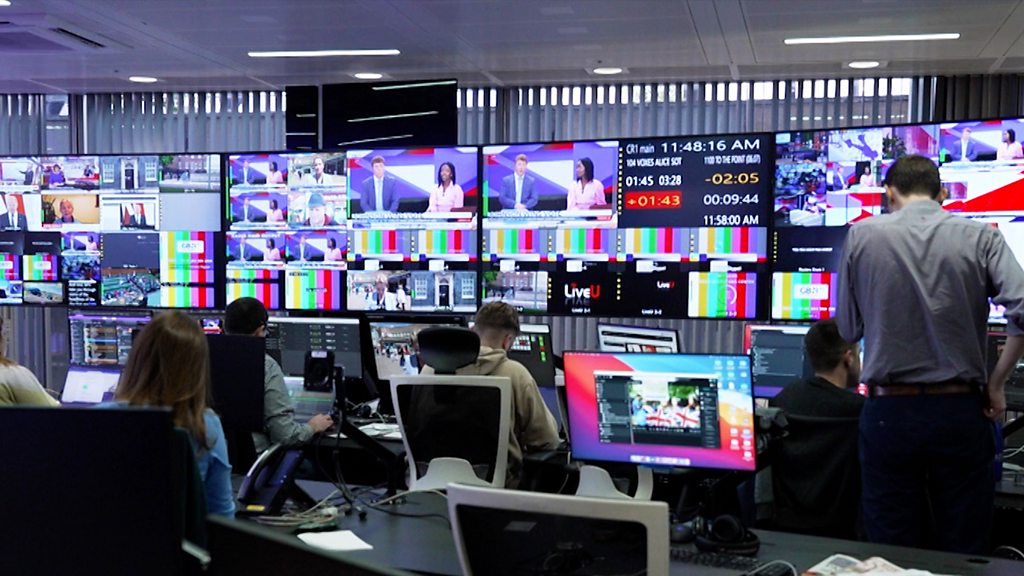
This screenshot has height=576, width=1024. Find the location of `computer monitor`. computer monitor is located at coordinates (657, 404), (787, 360), (398, 342), (540, 352), (291, 338), (112, 348).